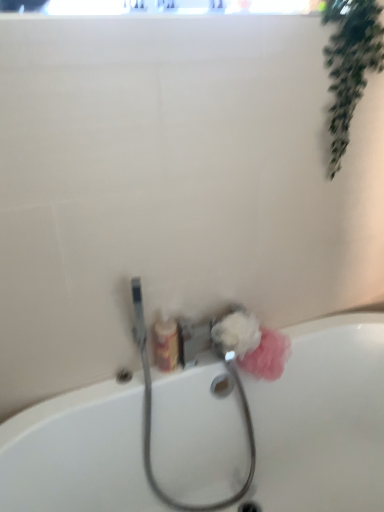
Question: Does point (231, 361) appear closer or farther from the camera than point (230, 339)?

Choices:
 (A) farther
 (B) closer

Answer: (A)

Question: In terms of size, does metallic silver garden hose at lower center appear bigger or smaller than white fluffy sponge at lower center, the second flower when ordered from right to left?

Choices:
 (A) big
 (B) small

Answer: (A)

Question: Which object is the closest to the white ceramic bathtub at lower center?

Choices:
 (A) translucent plastic soap dispenser at lower center
 (B) pink fluffy sponge at lower right, which appears as the first flower when viewed from the right
 (C) white fluffy sponge at lower center, the second flower when ordered from right to left
 (D) green leafy plant at upper right
 (E) metallic silver garden hose at lower center

Answer: (E)

Question: Which object is the farthest from the translucent plastic soap dispenser at lower center?

Choices:
 (A) white fluffy sponge at lower center, which is counted as the 1th flower, starting from the left
 (B) green leafy plant at upper right
 (C) white ceramic bathtub at lower center
 (D) metallic silver garden hose at lower center
 (E) pink fluffy sponge at lower right, which appears as the first flower when viewed from the right

Answer: (B)